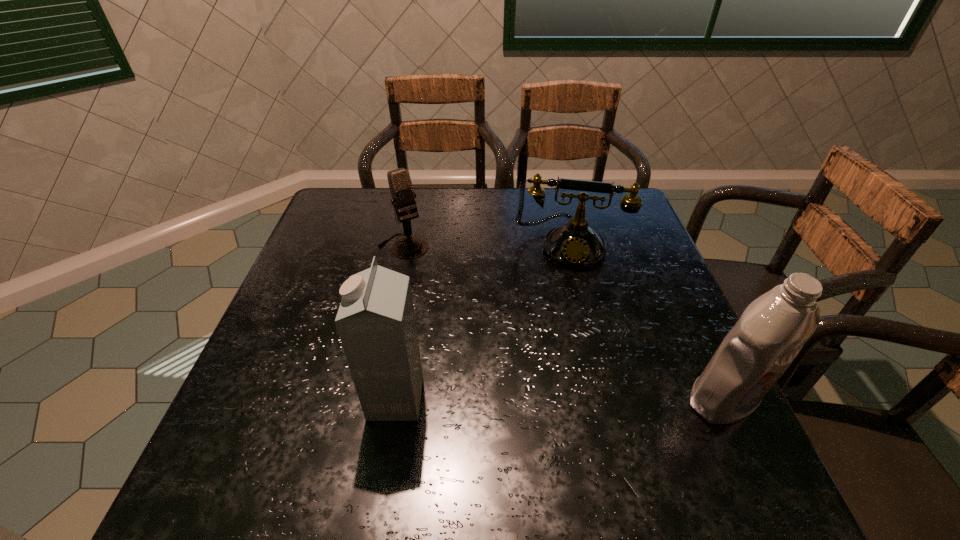
Image resolution: width=960 pixels, height=540 pixels. Find the location of `object at the near right corner`. object at the near right corner is located at coordinates (771, 331).

You are a GUI agent. You are given a task and a screenshot of the screen. Output one action in this format:
    pyautogui.click(x=<x>, y=<y>)
    Task: Click on the free spot at the far edge of the desktop
    
    Given the screenshot: What is the action you would take?
    point(481,197)

In the image, there is a desktop. What are the coordinates of `free space at the near edge` in the screenshot? It's located at pos(623,409).

You are a GUI agent. You are given a task and a screenshot of the screen. Output one action in this format:
    pyautogui.click(x=<x>, y=<y>)
    Task: Click on the free location at the left edge
    The width and height of the screenshot is (960, 540).
    Given the screenshot: What is the action you would take?
    pyautogui.click(x=335, y=288)

Where is `vacant space at the right edge of the desktop`? vacant space at the right edge of the desktop is located at coordinates (669, 392).

This screenshot has height=540, width=960. In order to click on blank space at the far left corner of the desktop in this screenshot , I will do `click(380, 194)`.

This screenshot has width=960, height=540. Identify the location of vacant space at the near left corner of the desktop. (303, 403).

This screenshot has height=540, width=960. In order to click on vacant space at the far right corner in this screenshot , I will do `click(587, 201)`.

Where is `unoccupied area between the telephone and the carton`? This screenshot has height=540, width=960. unoccupied area between the telephone and the carton is located at coordinates (482, 321).

Where is `vacant area that lies between the detergent and the microphone`? The width and height of the screenshot is (960, 540). vacant area that lies between the detergent and the microphone is located at coordinates (564, 323).